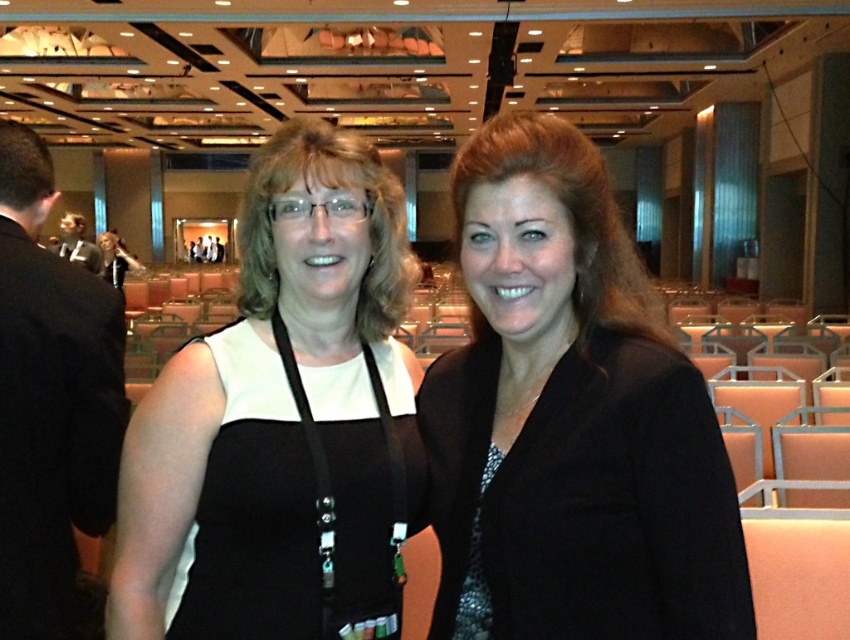
Does black textured blazer at center appear under black fabric dress at center?

No.

Is black textured blazer at center to the left of black fabric dress at center from the viewer's perspective?

Incorrect, black textured blazer at center is not on the left side of black fabric dress at center.

What are the coordinates of `black textured blazer at center` in the screenshot? It's located at (571, 422).

The image size is (850, 640). Find the location of `black textured blazer at center`. black textured blazer at center is located at coordinates (571, 422).

Can you confirm if black fabric dress at center is positioned to the left of black fabric lanyard at center?

Correct, you'll find black fabric dress at center to the left of black fabric lanyard at center.

Looking at this image, does black fabric dress at center have a lesser width compared to black fabric lanyard at center?

No.

Between point (285, 134) and point (425, 522), which one is positioned in front?

Point (285, 134) is more forward.

Find the location of a particular element. The height and width of the screenshot is (640, 850). black fabric dress at center is located at coordinates coord(275,410).

Is black textured blazer at center taller than black beaded necklace at center?

Yes, black textured blazer at center is taller than black beaded necklace at center.

The image size is (850, 640). Identify the location of black textured blazer at center. (571, 422).